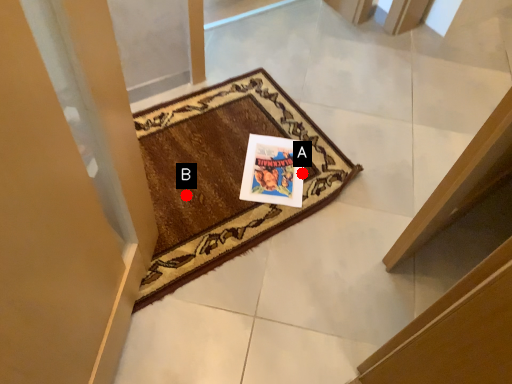
Question: Two points are circled on the image, labeled by A and B beside each circle. Which point is closer to the camera?

Choices:
 (A) A is closer
 (B) B is closer

Answer: (B)